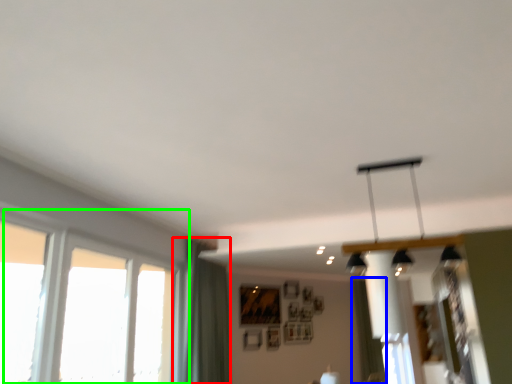
Question: Estimate the real-world distances between objects in this image. Which object is farther from curtain (highlighted by a red box), curtain (highlighted by a blue box) or window (highlighted by a green box)?

Choices:
 (A) curtain
 (B) window

Answer: (A)